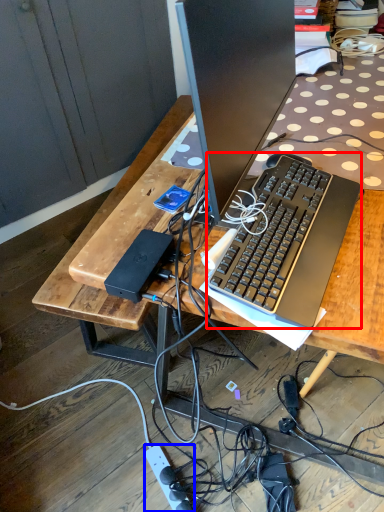
Question: Among these objects, which one is farthest to the camera, computer keyboard (highlighted by a red box) or power outlet (highlighted by a blue box)?

Choices:
 (A) computer keyboard
 (B) power outlet

Answer: (B)